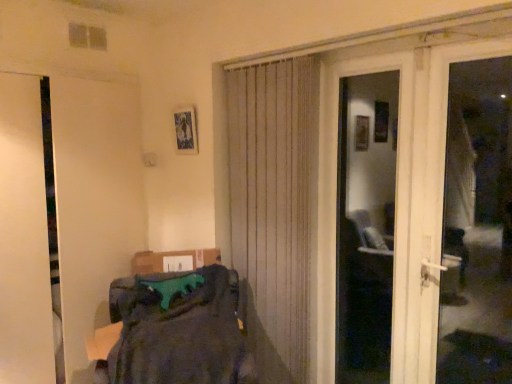
This screenshot has height=384, width=512. In order to click on vacant area on top of white glossy door at center, arranged as the second door when viewed from the left (from a real-world perspective) in this screenshot , I will do (x=360, y=55).